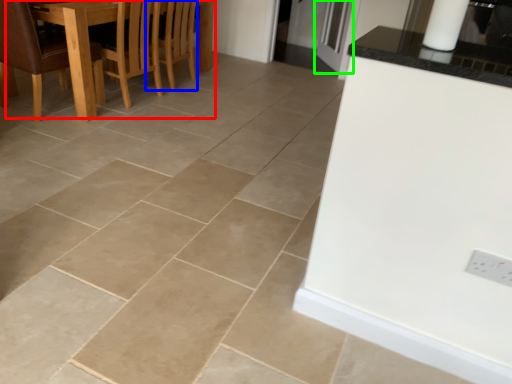
Question: Based on their relative distances, which object is nearer to kitchen & dining room table (highlighted by a red box)? Choose from armchair (highlighted by a blue box) and glass door (highlighted by a green box).

Choices:
 (A) armchair
 (B) glass door

Answer: (A)